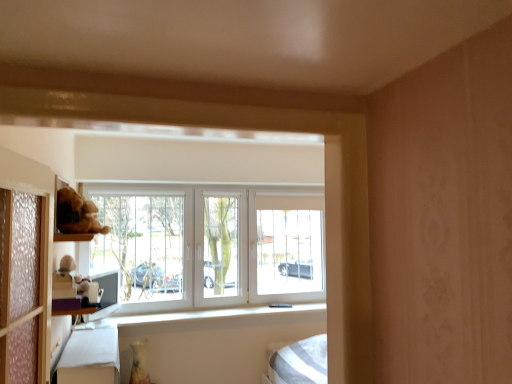
Question: Considering the relative sizes of white plastic window at center and white fabric bed frame at lower left in the image provided, is white plastic window at center wider than white fabric bed frame at lower left?

Choices:
 (A) no
 (B) yes

Answer: (A)

Question: Does white plastic window at center have a larger size compared to white fabric bed frame at lower left?

Choices:
 (A) no
 (B) yes

Answer: (B)

Question: Considering the relative positions of white plastic window at center and white fabric bed frame at lower left in the image provided, is white plastic window at center in front of white fabric bed frame at lower left?

Choices:
 (A) no
 (B) yes

Answer: (A)

Question: Is white plastic window at center to the right of white fabric bed frame at lower left from the viewer's perspective?

Choices:
 (A) yes
 (B) no

Answer: (A)

Question: From the image's perspective, is white plastic window at center above white fabric bed frame at lower left?

Choices:
 (A) no
 (B) yes

Answer: (B)

Question: From the image's perspective, is white fabric bed frame at lower left above or below white plush toy at left?

Choices:
 (A) above
 (B) below

Answer: (B)

Question: Is white fabric bed frame at lower left situated inside white plush toy at left or outside?

Choices:
 (A) inside
 (B) outside

Answer: (B)

Question: Considering their positions, is white fabric bed frame at lower left located in front of or behind white plush toy at left?

Choices:
 (A) front
 (B) behind

Answer: (A)

Question: Based on their positions, is white fabric bed frame at lower left located to the left or right of white plush toy at left?

Choices:
 (A) left
 (B) right

Answer: (B)

Question: Is point (281, 254) closer or farther from the camera than point (104, 367)?

Choices:
 (A) closer
 (B) farther

Answer: (B)

Question: Considering the relative positions of white plastic window at center and white fabric bed frame at lower left in the image provided, is white plastic window at center to the left or to the right of white fabric bed frame at lower left?

Choices:
 (A) right
 (B) left

Answer: (A)

Question: From a real-world perspective, is white plastic window at center physically located above or below white fabric bed frame at lower left?

Choices:
 (A) below
 (B) above

Answer: (B)

Question: From their relative heights in the image, would you say white plastic window at center is taller or shorter than white fabric bed frame at lower left?

Choices:
 (A) short
 (B) tall

Answer: (B)

Question: Does point tap(116, 352) appear closer or farther from the camera than point tap(125, 183)?

Choices:
 (A) farther
 (B) closer

Answer: (B)

Question: From a real-world perspective, relative to white plastic window at center, is white fabric bed frame at lower left vertically above or below?

Choices:
 (A) above
 (B) below

Answer: (B)